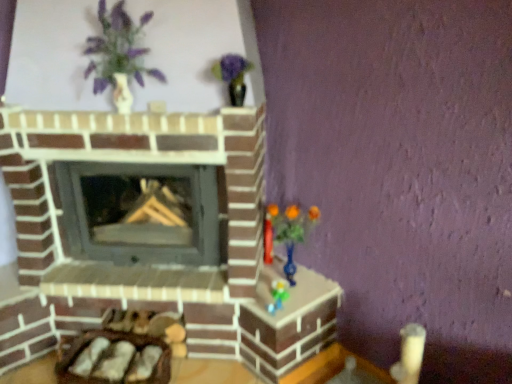
Question: Is point (315, 211) positioned closer to the camera than point (120, 21)?

Choices:
 (A) closer
 (B) farther

Answer: (B)

Question: In the image, is translucent blue vase at right positioned in front of or behind matte white vase at upper left?

Choices:
 (A) front
 (B) behind

Answer: (B)

Question: Based on their relative distances, which object is nearer to the translucent blue vase at right?

Choices:
 (A) smooth gray wood burning stove at center
 (B) matte white vase at upper left

Answer: (A)

Question: Estimate the real-world distances between objects in this image. Which object is farther from the matte white vase at upper left?

Choices:
 (A) smooth gray wood burning stove at center
 (B) translucent blue vase at right

Answer: (B)